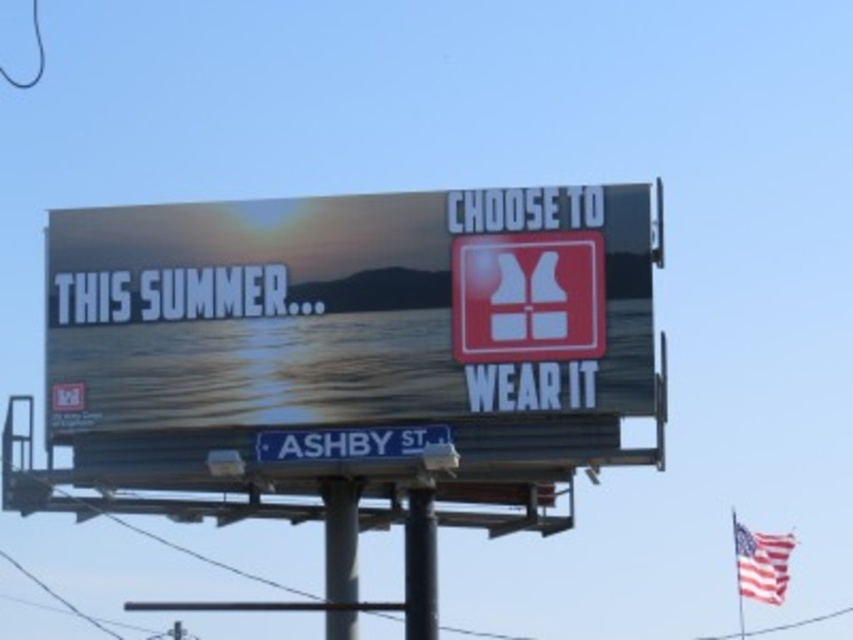
Question: Is metallic gray pole at center thinner than black metal pole at center?

Choices:
 (A) yes
 (B) no

Answer: (B)

Question: Among these points, which one is farthest from the camera?

Choices:
 (A) (335, 632)
 (B) (410, 540)

Answer: (A)

Question: Is metallic gray pole at center positioned before black metal pole at center?

Choices:
 (A) no
 (B) yes

Answer: (A)

Question: Considering the relative positions of white plastic street sign at lower center and red fabric flag at upper right in the image provided, where is white plastic street sign at lower center located with respect to red fabric flag at upper right?

Choices:
 (A) left
 (B) right

Answer: (A)

Question: Which object is closer to the camera taking this photo?

Choices:
 (A) white plastic street sign at lower center
 (B) red fabric flag at upper right
 (C) metallic gray pole at center

Answer: (A)

Question: Based on their relative distances, which object is nearer to the matte white sign at center?

Choices:
 (A) black metal pole at center
 (B) red fabric flag at upper right
 (C) metallic gray pole at center
 (D) white plastic street sign at lower center

Answer: (D)